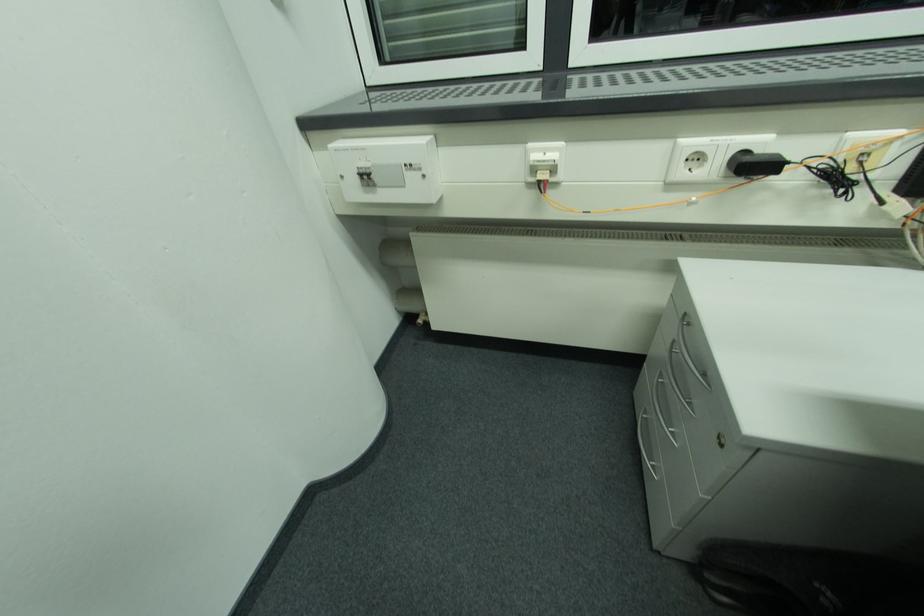
The width and height of the screenshot is (924, 616). I want to click on cabinet drawer lock, so click(723, 439).